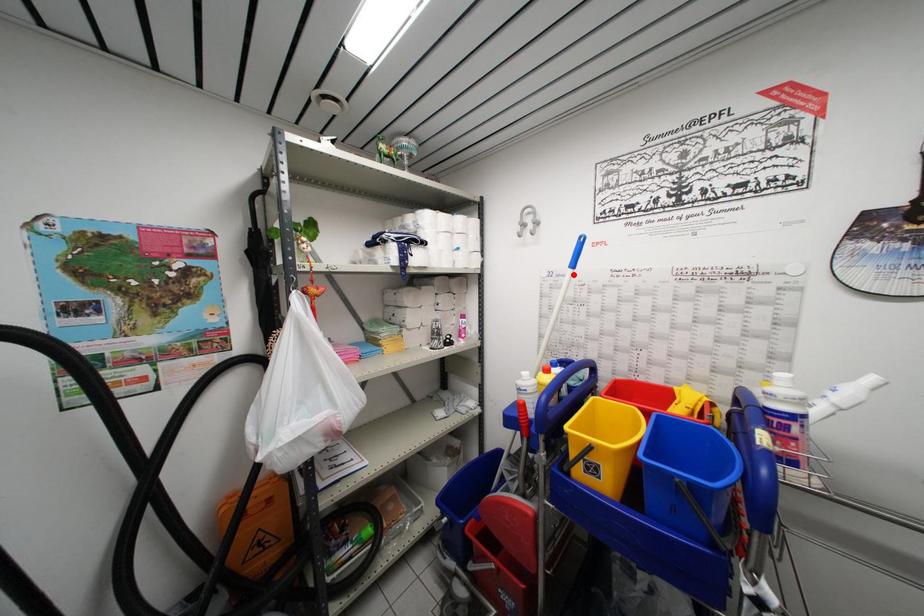
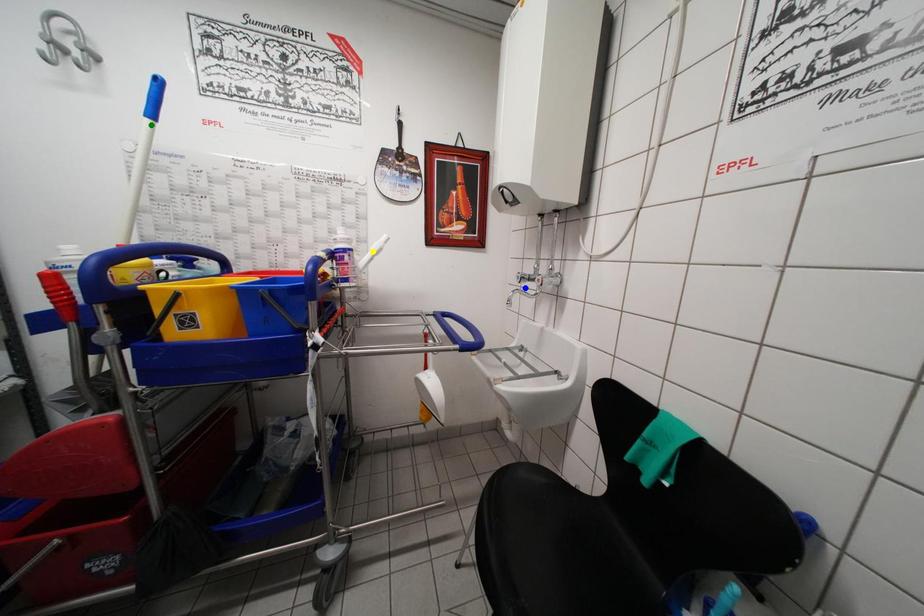
Question: I am providing you with two images of the same scene from different viewpoints. A red point is marked on the first image. You are given multiple points on the second image. Which mark in image 2 goes with the point in image 1?

Choices:
 (A) blue point
 (B) green point
 (C) yellow point

Answer: (B)